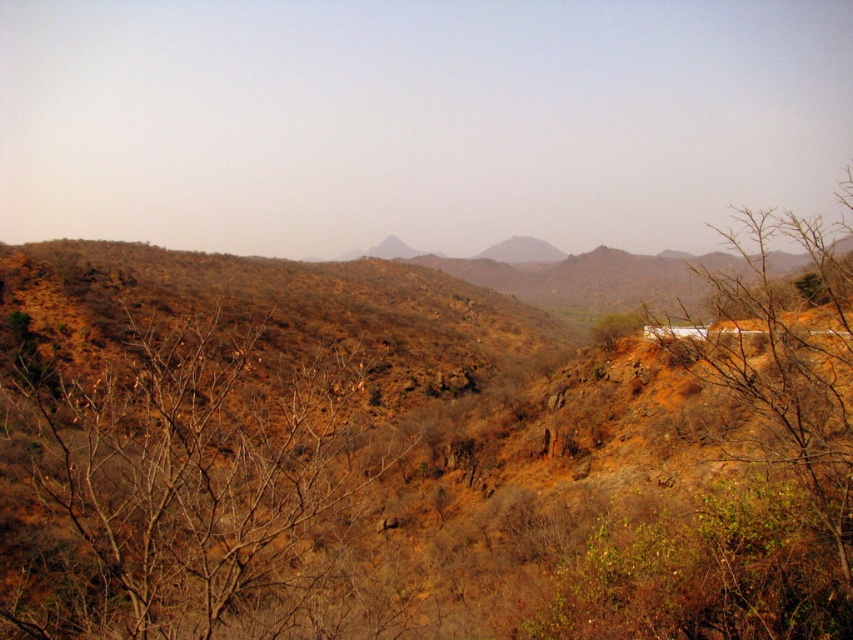
Can you confirm if brown leafless branches at left is taller than brown rocky mountain at center?

Incorrect, brown leafless branches at left's height is not larger of brown rocky mountain at center's.

Locate an element on the screen. brown leafless branches at left is located at coordinates (170, 476).

This screenshot has width=853, height=640. I want to click on brown leafless branches at left, so click(x=170, y=476).